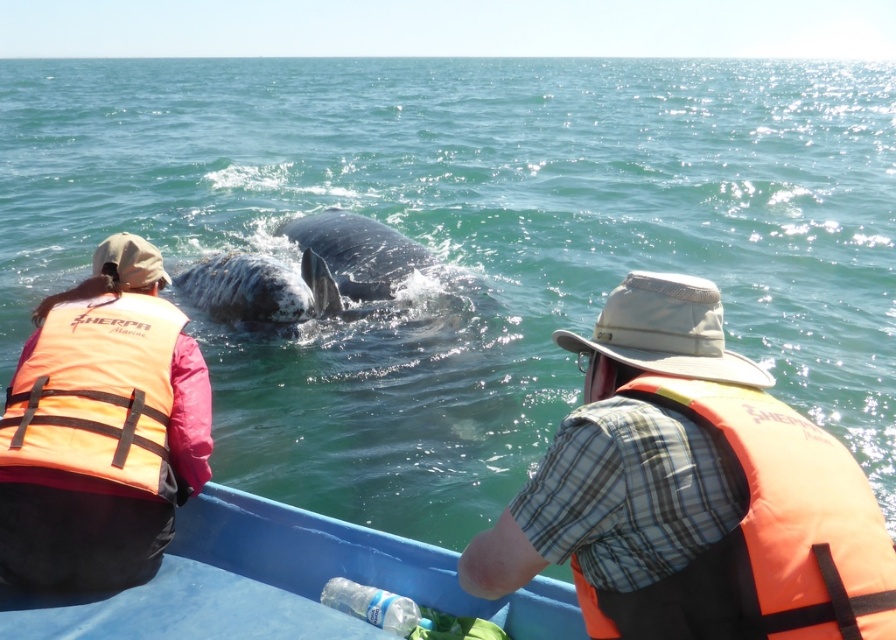
Question: Among these objects, which one is farthest from the camera?

Choices:
 (A) orange fabric life jacket at left
 (B) clear plastic bottle at lower center
 (C) orange fabric life jacket at right
 (D) blue plastic boat at lower center

Answer: (A)

Question: Can you confirm if blue plastic boat at lower center is positioned above clear plastic bottle at lower center?

Choices:
 (A) no
 (B) yes

Answer: (B)

Question: Can you confirm if orange fabric life jacket at left is positioned to the left of clear plastic bottle at lower center?

Choices:
 (A) yes
 (B) no

Answer: (A)

Question: Among these objects, which one is nearest to the camera?

Choices:
 (A) orange fabric life jacket at left
 (B) clear plastic bottle at lower center
 (C) blue plastic boat at lower center
 (D) orange fabric life jacket at right

Answer: (D)

Question: Which object is positioned closest to the orange fabric life jacket at left?

Choices:
 (A) blue plastic boat at lower center
 (B) clear plastic bottle at lower center

Answer: (A)

Question: Can you confirm if orange fabric life jacket at right is smaller than clear plastic bottle at lower center?

Choices:
 (A) no
 (B) yes

Answer: (A)